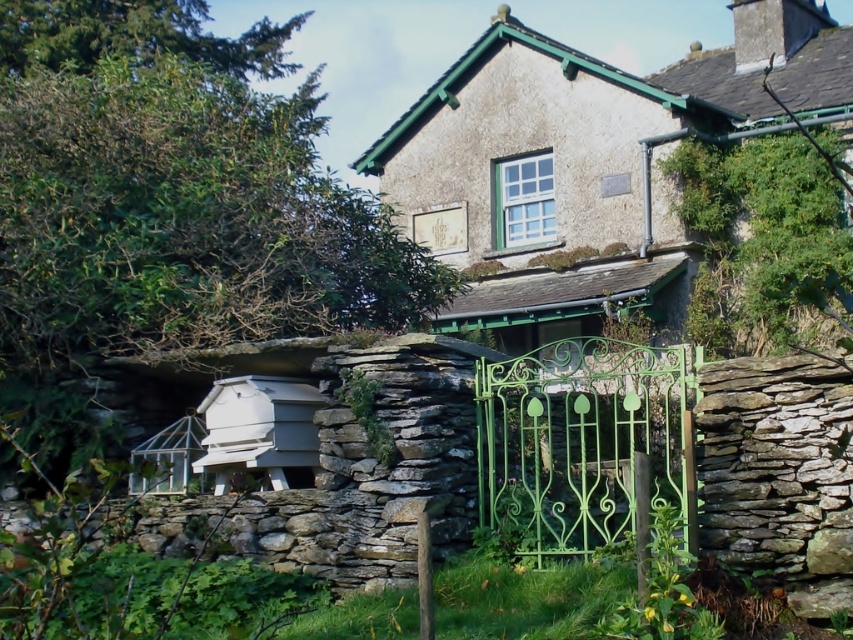
Is rustic stone cottage at center further to the viewer compared to green wrought iron gate at center?

Yes, it is behind green wrought iron gate at center.

Does rustic stone cottage at center have a lesser width compared to green wrought iron gate at center?

In fact, rustic stone cottage at center might be wider than green wrought iron gate at center.

Is point (442, 205) positioned before point (611, 438)?

No, (442, 205) is further to viewer.

Identify the location of rustic stone cottage at center. [585, 161].